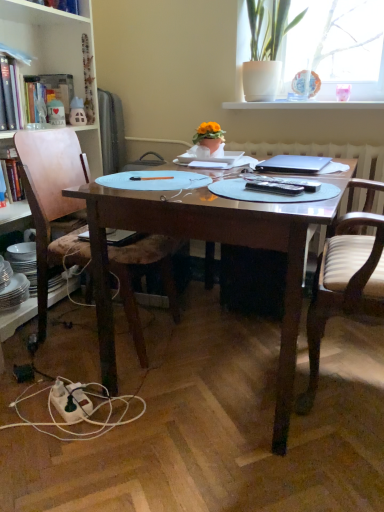
Locate an element on the screen. free spot below white striped wood chair at right, marked as the second chair in a left-to-right arrangement (from a real-world perspective) is located at coordinates (352, 379).